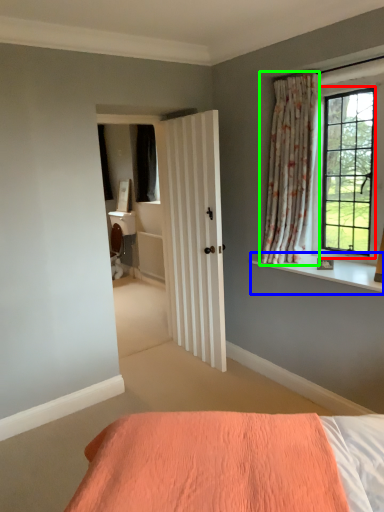
Question: Which object is the farthest from window (highlighted by a red box)? Choose among these: window sill (highlighted by a blue box) or curtain (highlighted by a green box).

Choices:
 (A) window sill
 (B) curtain

Answer: (A)